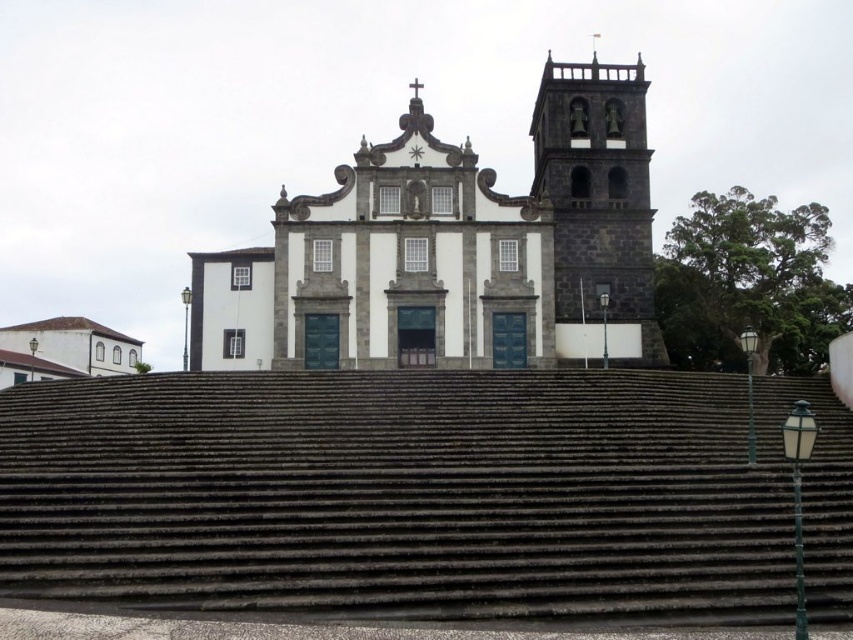
Question: Among these points, which one is farthest from the camera?

Choices:
 (A) (537, 156)
 (B) (618, 275)

Answer: (A)

Question: Does dark gray stone stairs at center appear under white stone church at center?

Choices:
 (A) no
 (B) yes

Answer: (B)

Question: Does dark gray stone stairs at center have a greater width compared to white stone church at center?

Choices:
 (A) no
 (B) yes

Answer: (B)

Question: Based on their relative distances, which object is farther from the white stone church at center?

Choices:
 (A) dark gray stone stairs at center
 (B) dark gray stone bell tower at upper right

Answer: (A)

Question: Can you confirm if white stone church at center is positioned above dark gray stone bell tower at upper right?

Choices:
 (A) no
 (B) yes

Answer: (A)

Question: Which of the following is the farthest from the observer?

Choices:
 (A) dark gray stone bell tower at upper right
 (B) dark gray stone stairs at center
 (C) white stone church at center

Answer: (A)